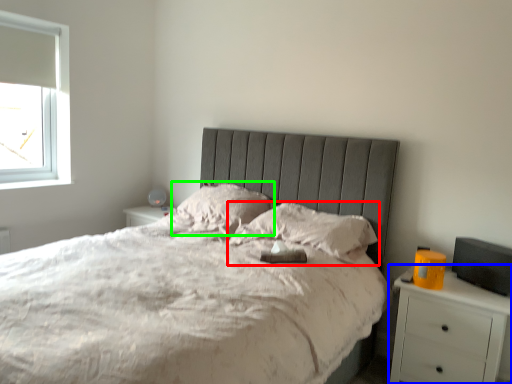
Question: Estimate the real-world distances between objects in this image. Which object is closer to pillow (highlighted by a red box), nightstand (highlighted by a blue box) or pillow (highlighted by a green box)?

Choices:
 (A) nightstand
 (B) pillow

Answer: (B)